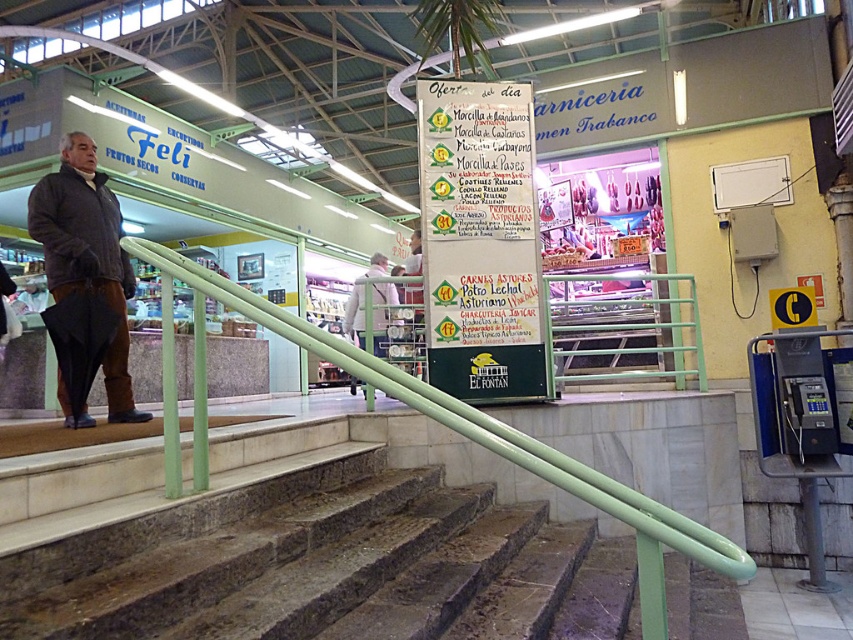
You are standing at the entrance of the market and want to locate the green marble stairs at center. According to the coordinates provided, where would you look to find them?

The green marble stairs at center are located at coordinates point (328, 564).

You are a customer in the market and see the dark gray jacket at left and the light gray fabric jacket at center. Which jacket is smaller in size?

The dark gray jacket at left is smaller in size compared to the light gray fabric jacket at center.